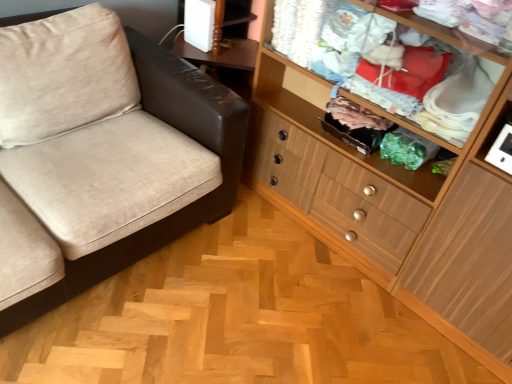
The height and width of the screenshot is (384, 512). Describe the element at coordinates (402, 206) in the screenshot. I see `wooden cabinet at right` at that location.

This screenshot has height=384, width=512. Find the location of `wooden cabinet at right`. wooden cabinet at right is located at coordinates (402, 206).

Where is `wooden cabinet at right`? The width and height of the screenshot is (512, 384). wooden cabinet at right is located at coordinates (402, 206).